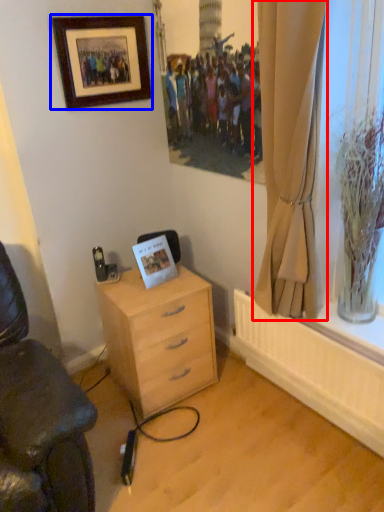
Question: Which object appears farthest to the camera in this image, curtain (highlighted by a red box) or picture frame (highlighted by a blue box)?

Choices:
 (A) curtain
 (B) picture frame

Answer: (B)